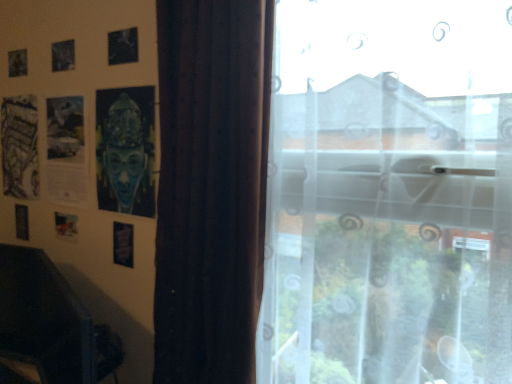
Question: Considering the relative positions of transparent sheer curtain at right and blue matte mask at upper left in the image provided, is transparent sheer curtain at right to the left of blue matte mask at upper left from the viewer's perspective?

Choices:
 (A) no
 (B) yes

Answer: (A)

Question: Is the position of transparent sheer curtain at right less distant than that of blue matte mask at upper left?

Choices:
 (A) yes
 (B) no

Answer: (A)

Question: Considering the relative sizes of transparent sheer curtain at right and blue matte mask at upper left in the image provided, is transparent sheer curtain at right smaller than blue matte mask at upper left?

Choices:
 (A) yes
 (B) no

Answer: (B)

Question: Is transparent sheer curtain at right next to blue matte mask at upper left?

Choices:
 (A) yes
 (B) no

Answer: (B)

Question: From the image's perspective, does transparent sheer curtain at right appear higher than blue matte mask at upper left?

Choices:
 (A) yes
 (B) no

Answer: (B)

Question: Does transparent sheer curtain at right appear on the right side of blue matte mask at upper left?

Choices:
 (A) no
 (B) yes

Answer: (B)

Question: From the image's perspective, would you say transparent sheer curtain at right is shown under black plastic swivel chair at lower left?

Choices:
 (A) yes
 (B) no

Answer: (B)

Question: Is transparent sheer curtain at right thinner than black plastic swivel chair at lower left?

Choices:
 (A) no
 (B) yes

Answer: (A)

Question: Can you confirm if transparent sheer curtain at right is shorter than black plastic swivel chair at lower left?

Choices:
 (A) yes
 (B) no

Answer: (B)

Question: Considering the relative positions of transparent sheer curtain at right and black plastic swivel chair at lower left in the image provided, is transparent sheer curtain at right to the right of black plastic swivel chair at lower left from the viewer's perspective?

Choices:
 (A) no
 (B) yes

Answer: (B)

Question: Does transparent sheer curtain at right have a smaller size compared to black plastic swivel chair at lower left?

Choices:
 (A) no
 (B) yes

Answer: (A)

Question: Is transparent sheer curtain at right oriented towards black plastic swivel chair at lower left?

Choices:
 (A) yes
 (B) no

Answer: (B)

Question: Could you tell me if blue matte mask at upper left is turned towards transparent sheer curtain at right?

Choices:
 (A) yes
 (B) no

Answer: (B)